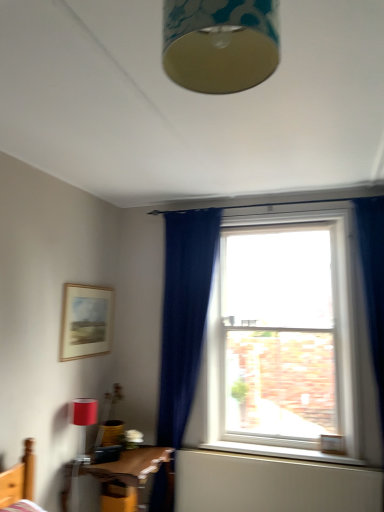
Identify the location of wooden table at lower left. This screenshot has width=384, height=512. (x=135, y=467).

The width and height of the screenshot is (384, 512). In order to click on wooden table at lower left in this screenshot , I will do `click(135, 467)`.

Can you confirm if matte red lampshade at lower left is positioned to the right of matte wooden picture frame at upper left?

Yes.

Is matte red lampshade at lower left far from matte wooden picture frame at upper left?

matte red lampshade at lower left is near matte wooden picture frame at upper left, not far away.

What's the angular difference between matte red lampshade at lower left and matte wooden picture frame at upper left's facing directions?

They differ by 0.531 degrees in their facing directions.

From a real-world perspective, is matte red lampshade at lower left on top of matte wooden picture frame at upper left?

No, from a real-world perspective, matte red lampshade at lower left is not on top of matte wooden picture frame at upper left.

Choose the correct answer: Is matte red lampshade at lower left inside white plastic window at center or outside it?

matte red lampshade at lower left exists outside the volume of white plastic window at center.

Is matte red lampshade at lower left facing towards white plastic window at center?

No, matte red lampshade at lower left is not facing towards white plastic window at center.

From the image's perspective, which one is positioned higher, matte red lampshade at lower left or white plastic window at center?

From the image's view, white plastic window at center is above.

Between matte red lampshade at lower left and white plastic window at center, which one has larger width?

Wider between the two is white plastic window at center.

Is point (79, 431) positioned before point (227, 449)?

Yes, it is.

Where is `light fixture that is above the white wooden window sill at lower center (from a real-world perspective)`? Image resolution: width=384 pixels, height=512 pixels. light fixture that is above the white wooden window sill at lower center (from a real-world perspective) is located at coordinates (83, 422).

Is matte red lampshade at lower left in front of or behind white wooden window sill at lower center in the image?

matte red lampshade at lower left is positioned closer to the viewer than white wooden window sill at lower center.

What's the angular difference between matte red lampshade at lower left and white wooden window sill at lower center's facing directions?

89.6 degrees.

Who is more distant, matte red lampshade at lower left or matte gold lampshade at upper center?

matte red lampshade at lower left is further away from the camera.

Locate an element on the screen. This screenshot has height=512, width=384. light fixture lying behind the matte gold lampshade at upper center is located at coordinates (83, 422).

Between matte red lampshade at lower left and matte gold lampshade at upper center, which one has less height?

With less height is matte gold lampshade at upper center.

How many degrees apart are the facing directions of matte red lampshade at lower left and matte gold lampshade at upper center?

89.5 degrees separate the facing orientations of matte red lampshade at lower left and matte gold lampshade at upper center.

How distant is white wooden window sill at lower center from wooden table at lower left?

72.32 centimeters.

From the image's perspective, who appears lower, white wooden window sill at lower center or wooden table at lower left?

From the image's view, wooden table at lower left is below.

Can you confirm if white wooden window sill at lower center is bigger than wooden table at lower left?

No, white wooden window sill at lower center is not bigger than wooden table at lower left.

Between point (298, 455) and point (100, 480), which one is positioned in front?

The point (100, 480) is more forward.

From the picture: Is matte gold lampshade at upper center turned away from matte red lampshade at lower left?

No, matte gold lampshade at upper center's orientation is not away from matte red lampshade at lower left.

How different are the orientations of matte gold lampshade at upper center and matte red lampshade at lower left in degrees?

The angle between the facing direction of matte gold lampshade at upper center and the facing direction of matte red lampshade at lower left is 89.5 degrees.

Would you say matte red lampshade at lower left is part of matte gold lampshade at upper center's contents?

No, matte red lampshade at lower left is not inside matte gold lampshade at upper center.

Is the position of matte gold lampshade at upper center less distant than that of matte red lampshade at lower left?

Yes.

In the scene shown: Is matte gold lampshade at upper center outside of white wooden window sill at lower center?

matte gold lampshade at upper center lies outside white wooden window sill at lower center's area.

Would you consider matte gold lampshade at upper center to be distant from white wooden window sill at lower center?

Indeed, matte gold lampshade at upper center is not near white wooden window sill at lower center.

Is matte gold lampshade at upper center bigger or smaller than white wooden window sill at lower center?

Considering their sizes, matte gold lampshade at upper center takes up more space than white wooden window sill at lower center.

Is matte gold lampshade at upper center oriented away from white wooden window sill at lower center?

No, matte gold lampshade at upper center is not facing the opposite direction of white wooden window sill at lower center.

The image size is (384, 512). I want to click on light fixture in front of the matte wooden picture frame at upper left, so click(x=83, y=422).

You are a GUI agent. You are given a task and a screenshot of the screen. Output one action in this format:
    pyautogui.click(x=<x>, y=<y>)
    Task: Click on the light fixture that appears on the left of white plastic window at center
    The width and height of the screenshot is (384, 512).
    Given the screenshot: What is the action you would take?
    pyautogui.click(x=83, y=422)

Looking at the image, which one is located further to wooden table at lower left, white plastic window at center or matte wooden picture frame at upper left?

white plastic window at center is further to wooden table at lower left.

Estimate the real-world distances between objects in this image. Which object is closer to white wooden window sill at lower center, wooden table at lower left or matte gold lampshade at upper center?

Among the two, wooden table at lower left is located nearer to white wooden window sill at lower center.

Which object lies further to the anchor point wooden table at lower left, white plastic window at center or matte gold lampshade at upper center?

The object further to wooden table at lower left is matte gold lampshade at upper center.

When comparing their distances from wooden table at lower left, does matte gold lampshade at upper center or white wooden window sill at lower center seem further?

matte gold lampshade at upper center is positioned further to the anchor wooden table at lower left.

Which object lies further to the anchor point matte red lampshade at lower left, matte wooden picture frame at upper left or white plastic window at center?

white plastic window at center lies further to matte red lampshade at lower left than the other object.

When comparing their distances from matte red lampshade at lower left, does matte gold lampshade at upper center or wooden table at lower left seem closer?

Among the two, wooden table at lower left is located nearer to matte red lampshade at lower left.

Based on their spatial positions, is matte wooden picture frame at upper left or matte gold lampshade at upper center further from wooden table at lower left?

matte gold lampshade at upper center.

Estimate the real-world distances between objects in this image. Which object is further from matte red lampshade at lower left, white wooden window sill at lower center or wooden table at lower left?

white wooden window sill at lower center lies further to matte red lampshade at lower left than the other object.

Identify the location of picture frame located between matte gold lampshade at upper center and white plastic window at center in the depth direction. (86, 321).

Where is `picture frame between matte gold lampshade at upper center and wooden table at lower left in the vertical direction`? picture frame between matte gold lampshade at upper center and wooden table at lower left in the vertical direction is located at coordinates (86, 321).

At what (x,y) coordinates should I click in order to perform the action: click on light fixture positioned between matte gold lampshade at upper center and matte wooden picture frame at upper left from near to far. Please return your answer as a coordinate pair (x, y). Looking at the image, I should click on (83, 422).

The height and width of the screenshot is (512, 384). What are the coordinates of `window sill situated between wooden table at lower left and white plastic window at center from left to right` in the screenshot? It's located at (280, 452).